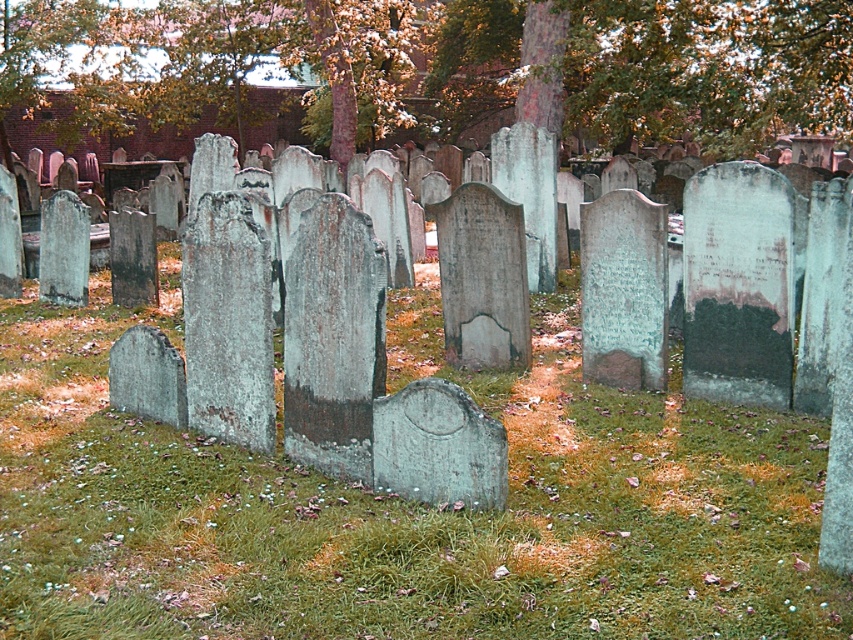
Question: Which of the following is the closest to the observer?

Choices:
 (A) green leafy tree at center
 (B) green mossy grass at center

Answer: (B)

Question: Can you confirm if green mossy grass at center is bigger than green leafy tree at center?

Choices:
 (A) no
 (B) yes

Answer: (A)

Question: Does green mossy grass at center come behind green leafy tree at center?

Choices:
 (A) yes
 (B) no

Answer: (B)

Question: Is green mossy grass at center above green leafy tree at center?

Choices:
 (A) yes
 (B) no

Answer: (B)